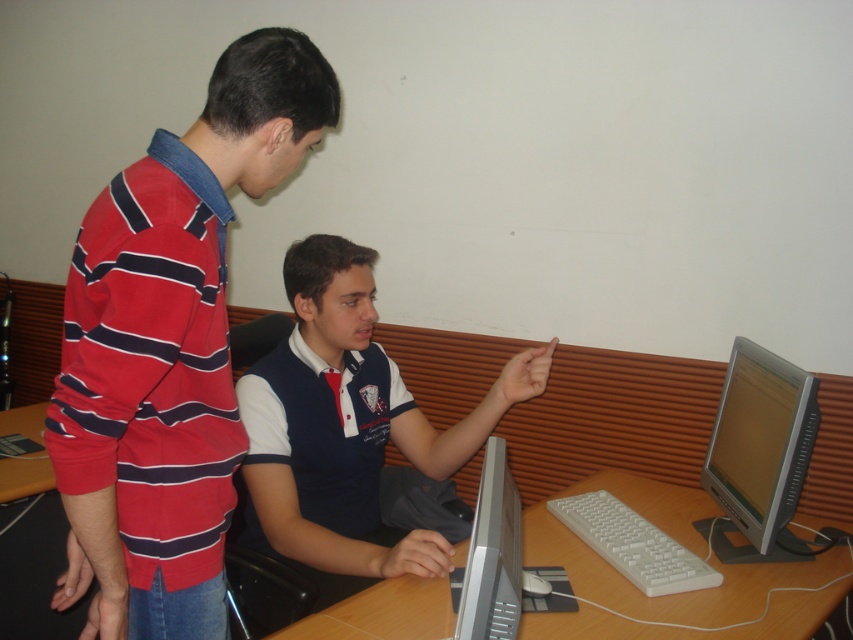
Between wooden desk at center and silver metallic monitor at right, which one has more height?

silver metallic monitor at right is taller.

Who is higher up, wooden desk at center or silver metallic monitor at right?

silver metallic monitor at right is above.

Does point (405, 586) come closer to viewer compared to point (724, 481)?

Yes, point (405, 586) is closer to viewer.

Locate an element on the screen. wooden desk at center is located at coordinates (669, 595).

Does red striped polo shirt at upper left appear over navy blue jersey at center?

Correct, red striped polo shirt at upper left is located above navy blue jersey at center.

Where is `red striped polo shirt at upper left`? red striped polo shirt at upper left is located at coordinates (169, 348).

Is wooden desk at center positioned before white plastic keyboard at lower center?

Yes, it is.

Describe the element at coordinates (669, 595) in the screenshot. The height and width of the screenshot is (640, 853). I see `wooden desk at center` at that location.

Is point (671, 493) in front of point (657, 552)?

No, it is behind (657, 552).

At what (x,y) coordinates should I click in order to perform the action: click on wooden desk at center. Please return your answer as a coordinate pair (x, y). Looking at the image, I should click on (669, 595).